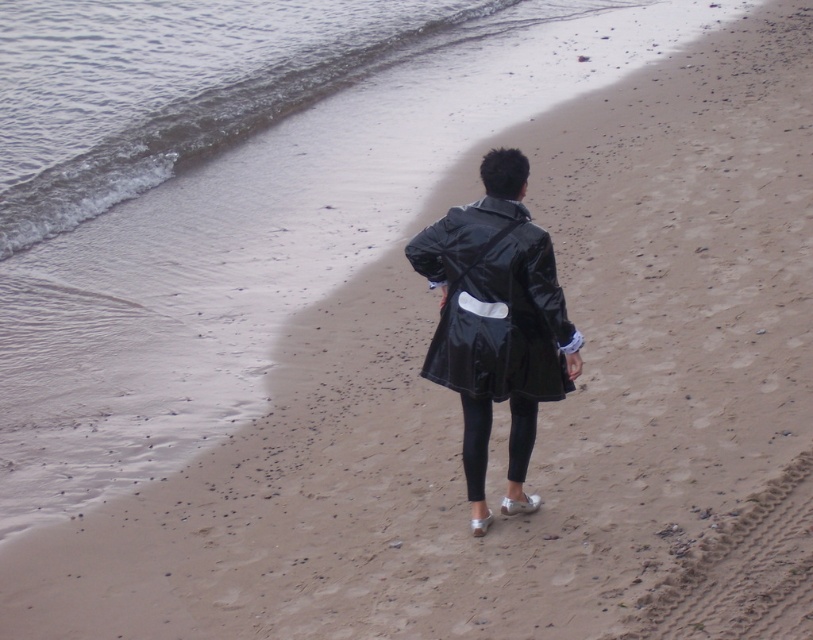
You are a photographer trying to capture the scene of the beach. You want to ensure that both the glossy water at upper left and the glossy black coat at center are in focus. Given that your camera can only focus on objects within a 10 meter range, will both objects be in focus?

The glossy water at upper left is 10.73 meters away from the glossy black coat at center. Since the distance between them is greater than 10 meters, the camera cannot focus on both objects simultaneously within the 10 meter range.

You are standing on the beach and want to reach the point marked as point (298, 90). If you walk directly towards it, how far will you have to walk?

The point (298, 90) is 18.85 meters from the viewer, so you will have to walk 18.85 meters to reach it.

You are a photographer trying to capture the glossy water at upper left and the glossy black coat at center in the same frame. Which object should you focus on first to ensure both are in focus?

You should focus on the glossy black coat at center first because it is closer to you than the glossy water at upper left, which is further away. This way, both objects will be in focus when using a proper depth of field.